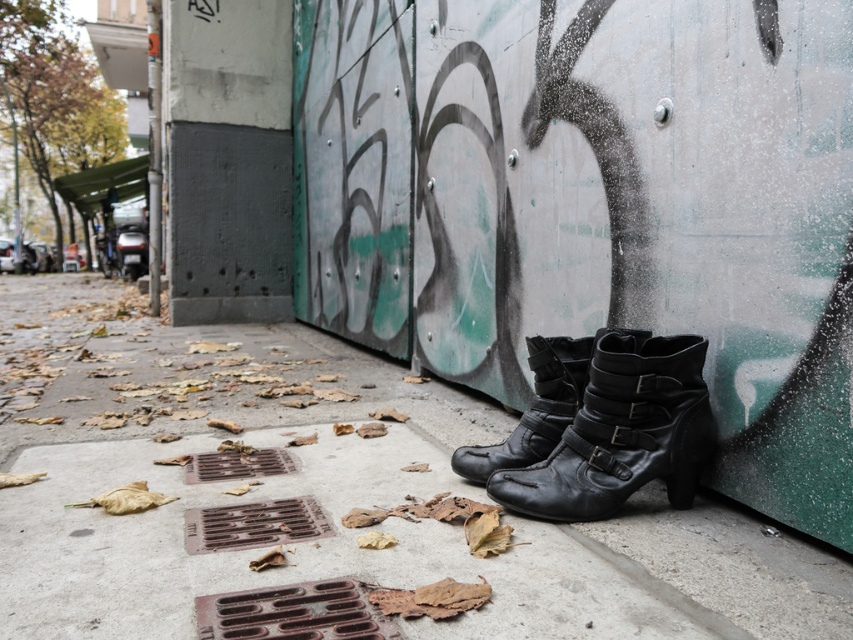
You are a photographer trying to capture both the black leather boots at lower right and the black leather boots at center in a single frame. Given their sizes, which pair should you focus on to ensure they are both clearly visible in your photo?

The black leather boots at lower right is bigger than the black leather boots at center, so focusing on the larger pair will help ensure both are clearly visible in the photo.

You are a delivery person trying to place a package between the black leather boot at lower right and the black leather boots at center. Is there enough space for the package?

The black leather boot at lower right is positioned under the black leather boots at center, meaning there is no vertical space between them. Therefore, you cannot place the package between them.

You are a delivery person trying to place a package between the black leather boots at lower right and the black leather boot at lower right. Can you fit the package if it requires 30 inches of space?

The black leather boots at lower right and black leather boot at lower right are 30.19 inches apart, so yes, the package requiring 30 inches can fit between them since there is enough space.